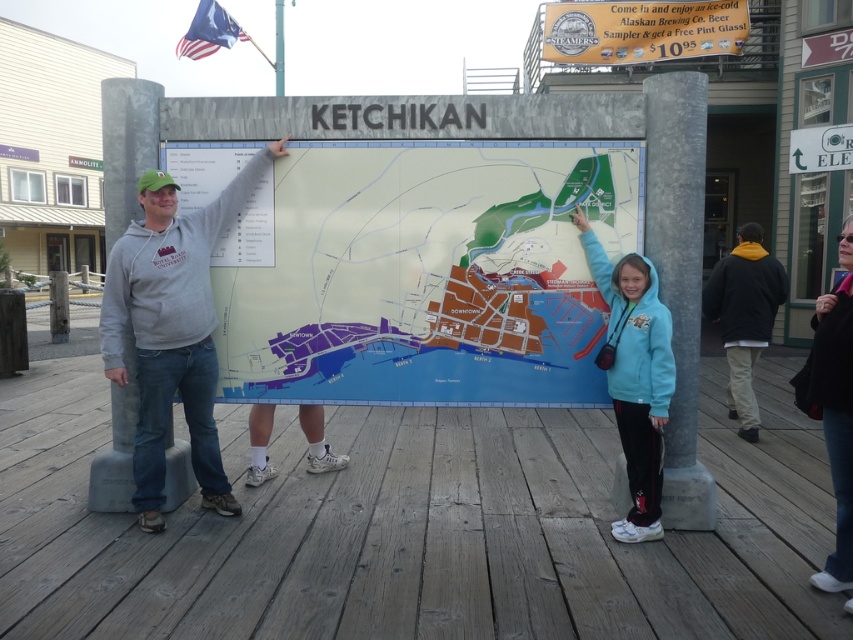
You are standing in front of the map of Ketchikan, Alaska. You notice the metallic gold sign at upper center and the american flag at upper left. Which object is positioned closer to you?

The metallic gold sign at upper center is closer to the viewer than the american flag at upper left.

In the scene shown: You are standing in front of the map of Ketchikan, Alaska. You see the matte plastic map at center and the gray hoodie at center. Which object is positioned higher from the ground?

The matte plastic map at center is located above the gray hoodie at center, so it is positioned higher from the ground.